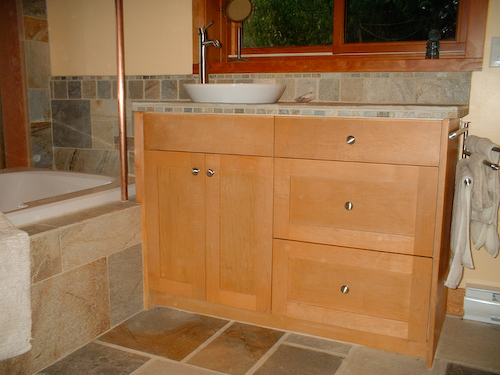
I want to click on brown and gray tones tile floor, so click(x=182, y=324).